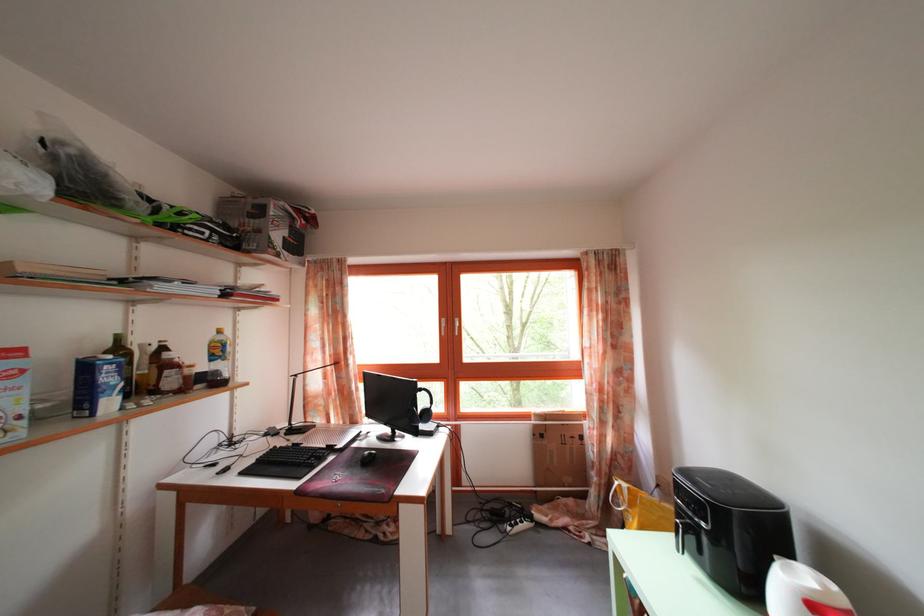
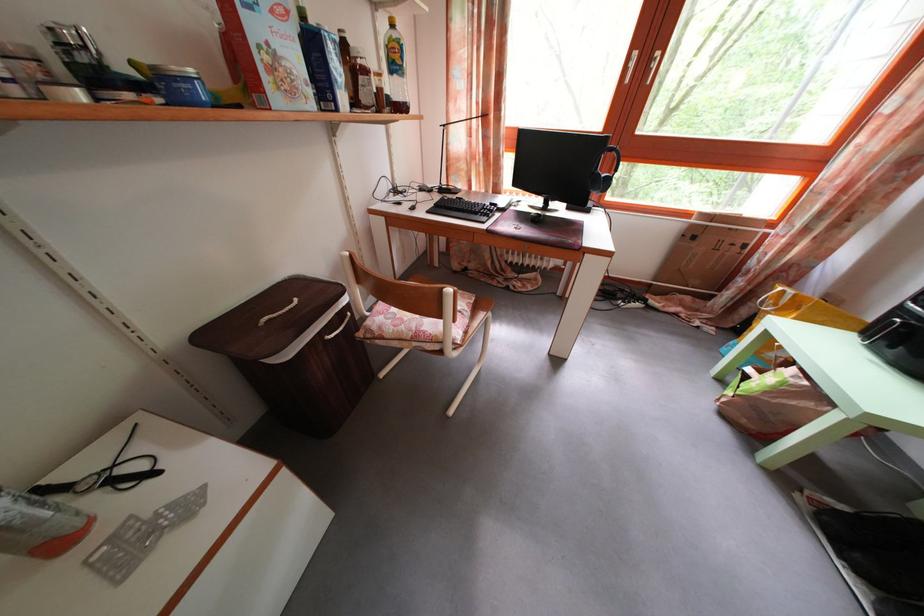
Question: Based on the continuous images, in which direction is the camera rotating? Reply with the corresponding letter.

Choices:
 (A) Left
 (B) Right
 (C) Up
 (D) Down

Answer: (D)